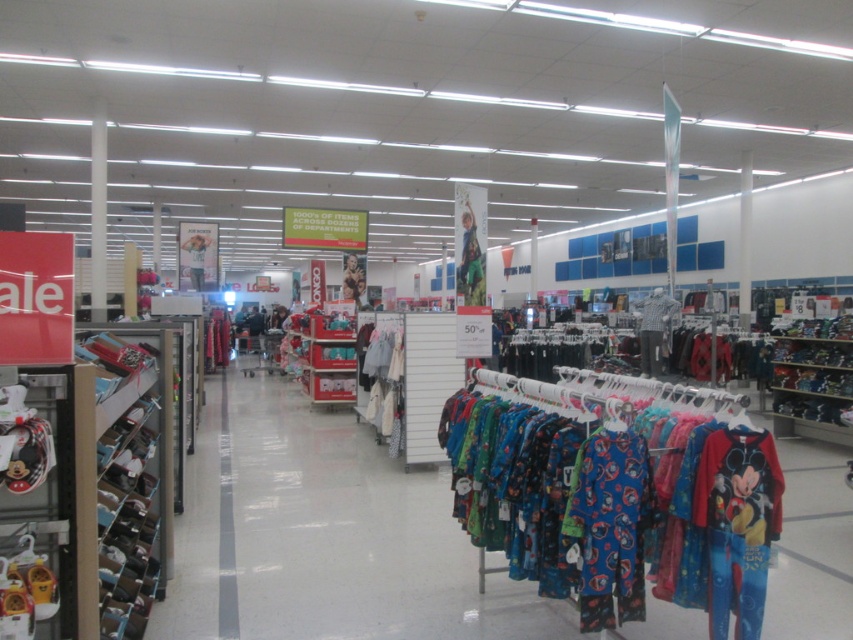
Is metallic silver shoes at left to the left of white cotton shirt at center from the viewer's perspective?

Indeed, metallic silver shoes at left is positioned on the left side of white cotton shirt at center.

Who is shorter, metallic silver shoes at left or white cotton shirt at center?

Standing shorter between the two is white cotton shirt at center.

The width and height of the screenshot is (853, 640). In order to click on metallic silver shoes at left in this screenshot , I will do `click(131, 472)`.

Looking at this image, is metallic mickey mouse ears at left below blue fleece pajamas at center?

Incorrect, metallic mickey mouse ears at left is not positioned below blue fleece pajamas at center.

Does point (28, 472) come in front of point (601, 541)?

That is True.

Looking at this image, who is more forward, [41,524] or [585,605]?

Positioned in front is point [41,524].

Where is `metallic mickey mouse ears at left`? Image resolution: width=853 pixels, height=640 pixels. metallic mickey mouse ears at left is located at coordinates (41, 499).

Between metallic silver shoes at left and metallic mickey mouse ears at left, which one has less height?

Standing shorter between the two is metallic mickey mouse ears at left.

Does metallic silver shoes at left appear under metallic mickey mouse ears at left?

Yes, metallic silver shoes at left is below metallic mickey mouse ears at left.

Image resolution: width=853 pixels, height=640 pixels. What do you see at coordinates (131, 472) in the screenshot?
I see `metallic silver shoes at left` at bounding box center [131, 472].

Locate an element on the screen. This screenshot has height=640, width=853. metallic silver shoes at left is located at coordinates (131, 472).